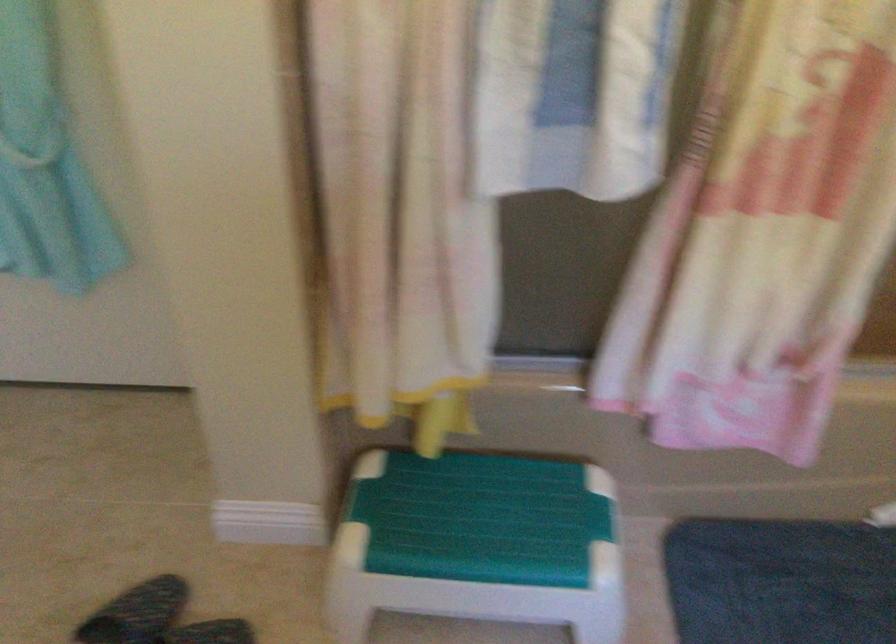
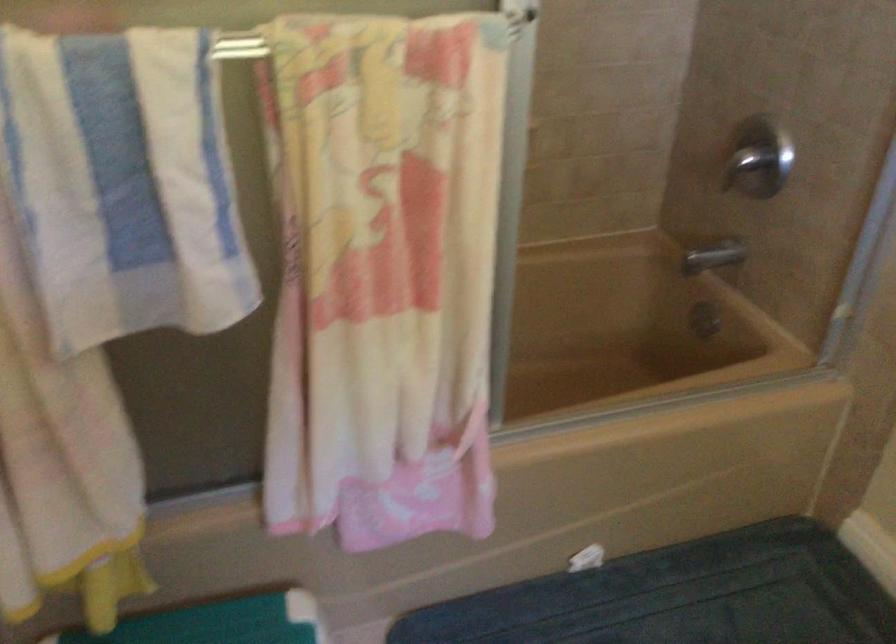
Question: The camera is either moving clockwise (left) or counter-clockwise (right) around the object. The first image is from the beginning of the video and the second image is from the end. Is the camera moving left or right when shooting the video?

Choices:
 (A) Left
 (B) Right

Answer: (A)